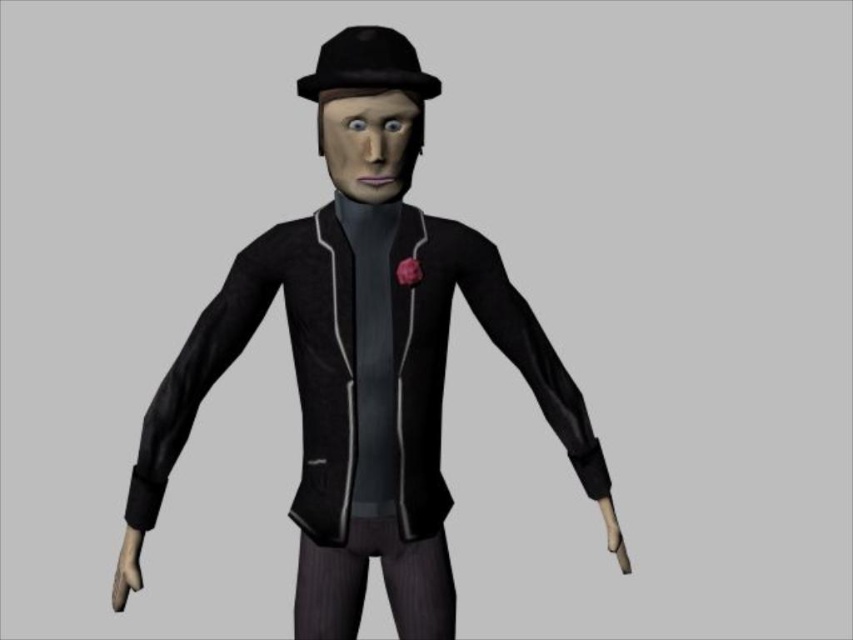
Can you confirm if matte black jacket at center is thinner than black matte fedora at center?

No, matte black jacket at center is not thinner than black matte fedora at center.

Between matte black jacket at center and black matte fedora at center, which one has less height?

black matte fedora at center is shorter.

Which is in front, point (378, 212) or point (408, 61)?

Positioned in front is point (408, 61).

This screenshot has width=853, height=640. I want to click on matte black jacket at center, so click(363, 376).